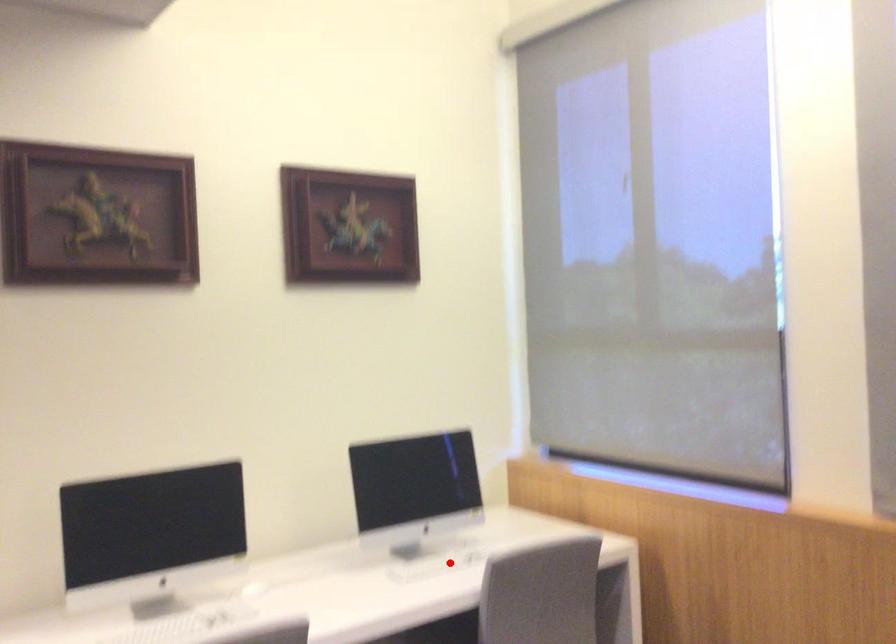
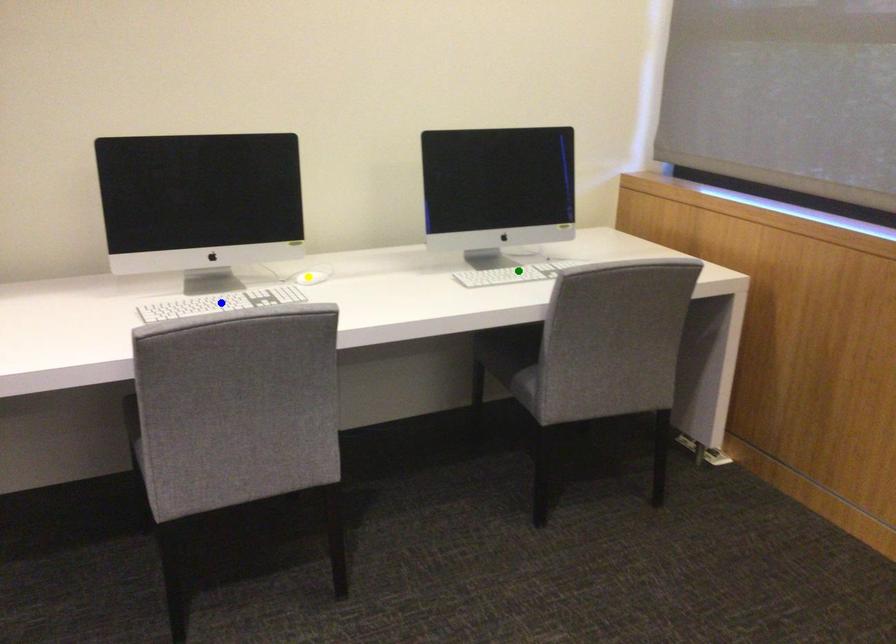
Question: I am providing you with two images of the same scene from different viewpoints. A red point is marked on the first image. You are given multiple points on the second image. Can you choose the point in image 2 that corresponds to the point in image 1?

Choices:
 (A) yellow point
 (B) green point
 (C) blue point

Answer: (B)